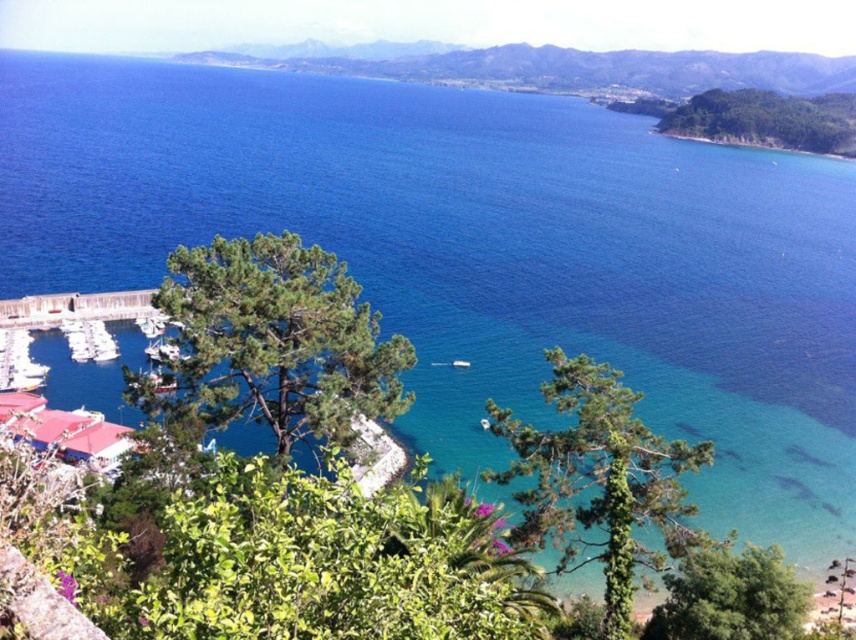
Question: Among these objects, which one is nearest to the camera?

Choices:
 (A) brown wooden dock at lower left
 (B) white glossy boat at lower left

Answer: (B)

Question: Which point is farther from the camera taking this photo?

Choices:
 (A) (30, 321)
 (B) (16, 349)

Answer: (A)

Question: Observing the image, what is the correct spatial positioning of brown wooden dock at lower left in reference to white glossy boat at lower left?

Choices:
 (A) below
 (B) above

Answer: (B)

Question: Does brown wooden dock at lower left appear on the left side of white glossy boat at lower left?

Choices:
 (A) yes
 (B) no

Answer: (B)

Question: Can you confirm if brown wooden dock at lower left is bigger than white glossy boat at lower left?

Choices:
 (A) no
 (B) yes

Answer: (B)